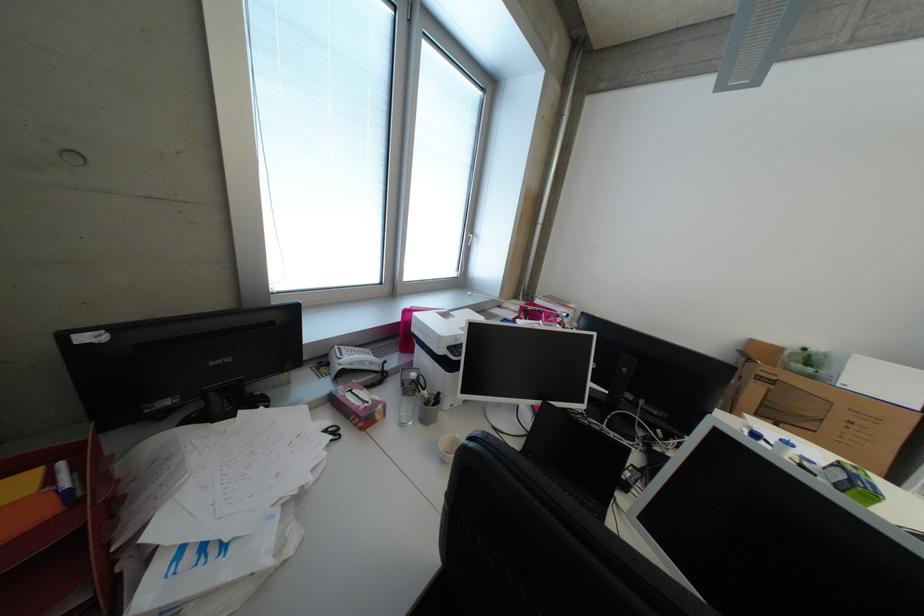
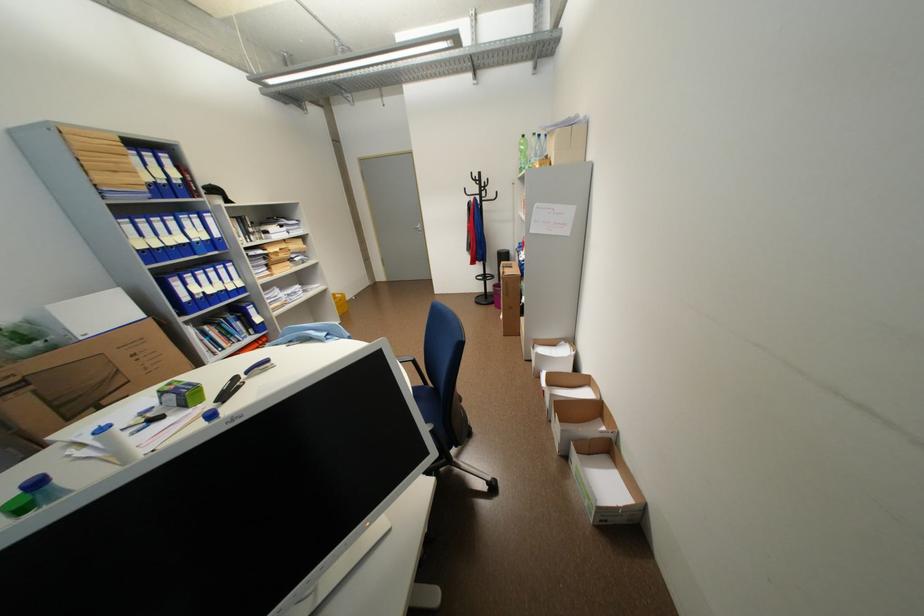
In the second image, find the point that corresponds to (x=847, y=466) in the first image.

(171, 394)